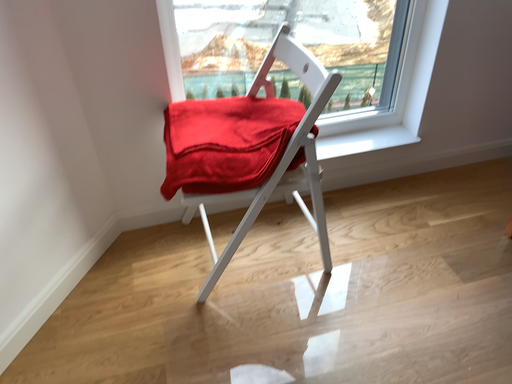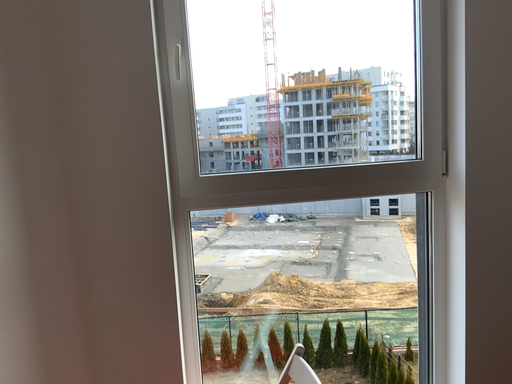
Question: How did the camera likely rotate when shooting the video?

Choices:
 (A) rotated upward
 (B) rotated downward

Answer: (A)